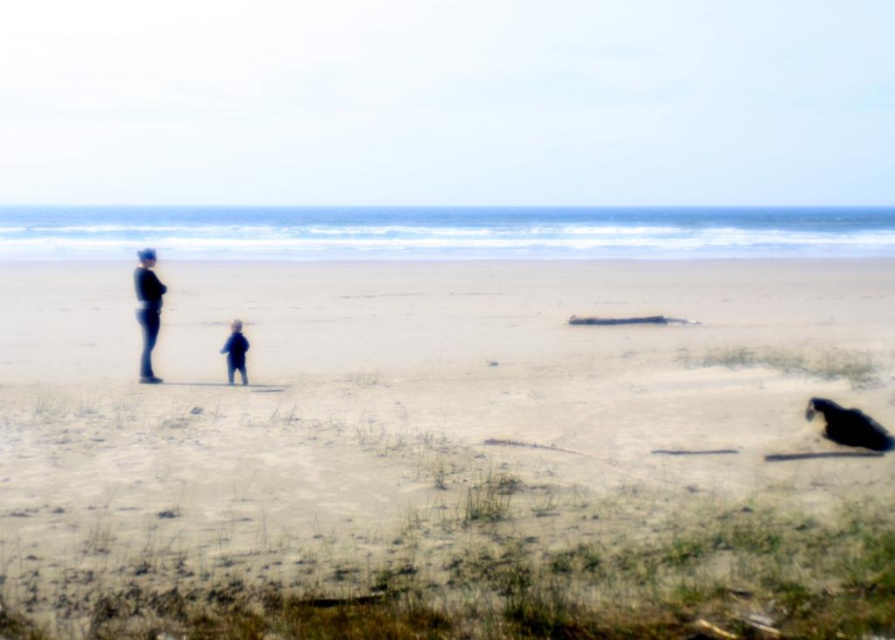
Question: Which point is closer to the camera?

Choices:
 (A) [x=804, y=413]
 (B) [x=135, y=289]
 (C) [x=232, y=472]

Answer: (C)

Question: Is black fur dog at lower right smaller than matte black figure at left?

Choices:
 (A) no
 (B) yes

Answer: (B)

Question: Estimate the real-world distances between objects in this image. Which object is closer to the black fur dog at lower right?

Choices:
 (A) smooth sand beach at center
 (B) matte black figure at left

Answer: (A)

Question: Where is matte black figure at left located in relation to smooth black figure at center in the image?

Choices:
 (A) left
 (B) right

Answer: (A)

Question: Can you confirm if black fur dog at lower right is bigger than matte black figure at left?

Choices:
 (A) yes
 (B) no

Answer: (B)

Question: Based on their relative distances, which object is farther from the smooth black figure at center?

Choices:
 (A) smooth sand beach at center
 (B) matte black figure at left

Answer: (A)